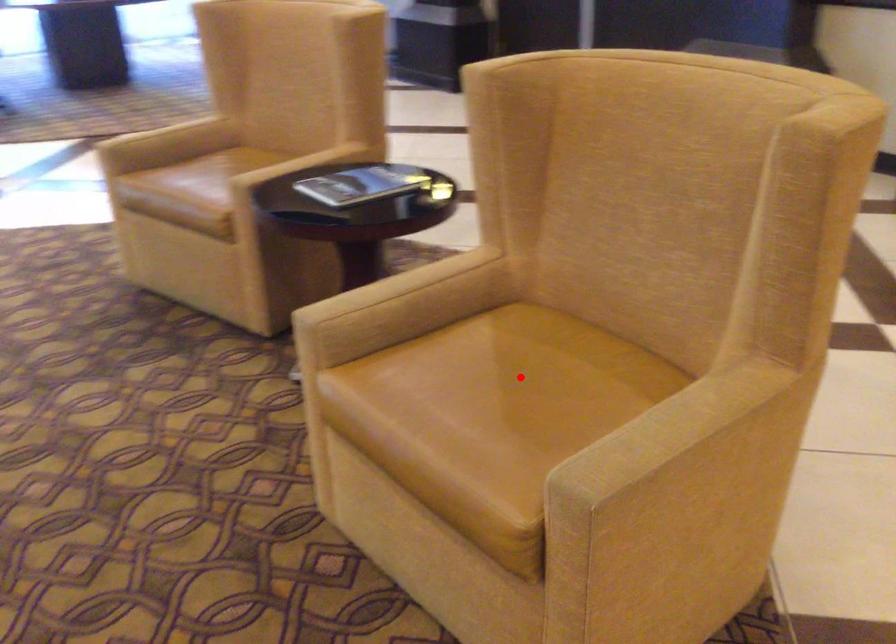
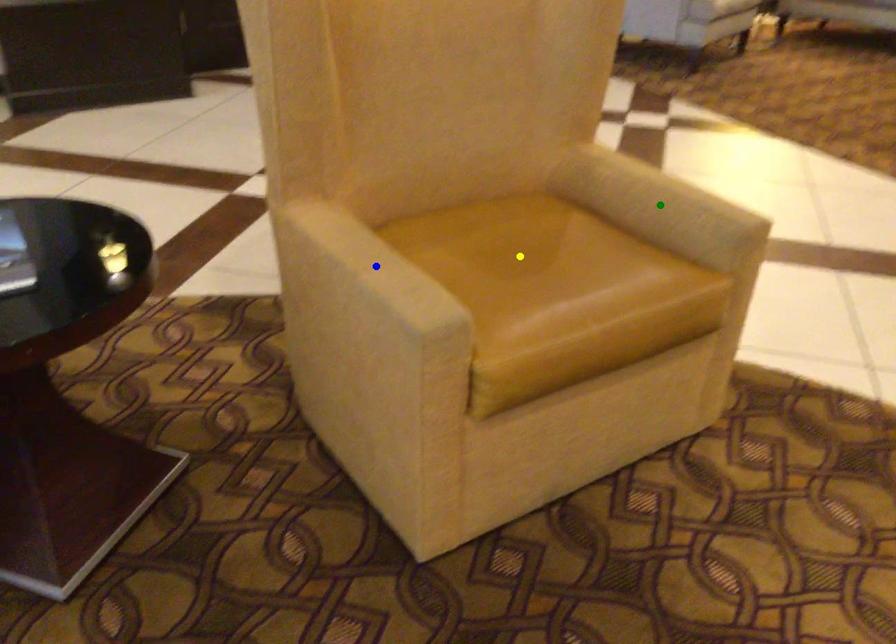
Question: I am providing you with two images of the same scene from different viewpoints. A red point is marked on the first image. You are given multiple points on the second image. Which point in image 2 is actually the same real-world point as the red point in image 1?

Choices:
 (A) blue point
 (B) yellow point
 (C) green point

Answer: (B)